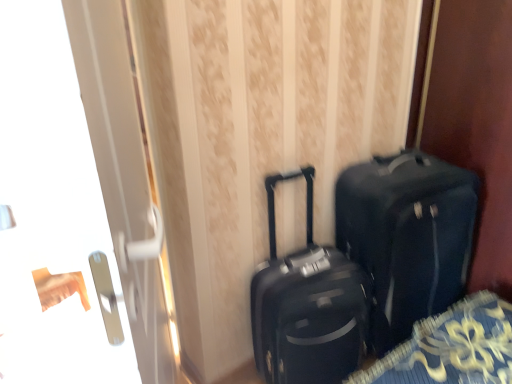
Question: Is transparent glass door at left at the left side of matte black suitcase at center?

Choices:
 (A) yes
 (B) no

Answer: (A)

Question: From a real-world perspective, is transparent glass door at left below matte black suitcase at center?

Choices:
 (A) yes
 (B) no

Answer: (B)

Question: Could you tell me if transparent glass door at left is turned towards matte black suitcase at center?

Choices:
 (A) yes
 (B) no

Answer: (A)

Question: Would you say matte black suitcase at center is part of transparent glass door at left's contents?

Choices:
 (A) yes
 (B) no

Answer: (B)

Question: Is transparent glass door at left positioned with its back to matte black suitcase at center?

Choices:
 (A) no
 (B) yes

Answer: (B)

Question: Is transparent glass door at left not near matte black suitcase at center?

Choices:
 (A) no
 (B) yes

Answer: (A)

Question: Does transparent glass door at left have a lesser height compared to matte black suitcase at center?

Choices:
 (A) no
 (B) yes

Answer: (A)

Question: Is transparent glass door at left positioned with its back to matte black suitcase at center?

Choices:
 (A) no
 (B) yes

Answer: (B)

Question: From the image's perspective, is transparent glass door at left below matte black suitcase at center?

Choices:
 (A) no
 (B) yes

Answer: (B)

Question: Is transparent glass door at left to the left of matte black suitcase at center from the viewer's perspective?

Choices:
 (A) yes
 (B) no

Answer: (A)

Question: Can you confirm if transparent glass door at left is bigger than matte black suitcase at center?

Choices:
 (A) no
 (B) yes

Answer: (B)

Question: Considering the relative sizes of transparent glass door at left and matte black suitcase at center in the image provided, is transparent glass door at left taller than matte black suitcase at center?

Choices:
 (A) yes
 (B) no

Answer: (A)

Question: Is matte black suitcase at center wider than transparent glass door at left?

Choices:
 (A) yes
 (B) no

Answer: (A)